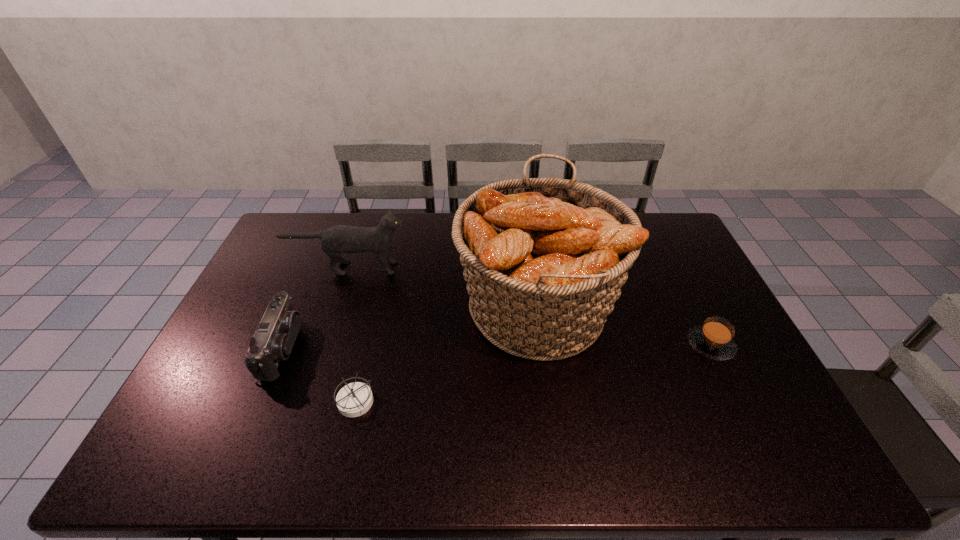
Where is `the tallest object`? This screenshot has height=540, width=960. the tallest object is located at coordinates (544, 259).

This screenshot has width=960, height=540. What are the coordinates of `the second object from right to left` in the screenshot? It's located at pos(544,259).

Identify the location of the second tallest object. (338, 239).

Where is `the third tallest object`? the third tallest object is located at coordinates (275, 336).

Where is `the rightmost object`? This screenshot has width=960, height=540. the rightmost object is located at coordinates (714, 339).

Where is `compass`? This screenshot has width=960, height=540. compass is located at coordinates (353, 400).

Where is `free spot located on the back of the fourth object from left to right`? The height and width of the screenshot is (540, 960). free spot located on the back of the fourth object from left to right is located at coordinates (525, 219).

Identify the location of vacant area situated on the front-facing side of the cat. (478, 268).

Identify the location of vacant region located 0.130m on the front-facing side of the third tallest object. The width and height of the screenshot is (960, 540). (344, 348).

Locate an element on the screen. This screenshot has width=960, height=540. vacant position located on the back of the cappuccino is located at coordinates (666, 255).